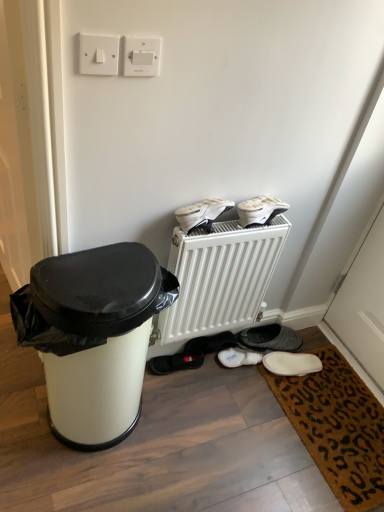
Identify the location of free space above brown coir mat at lower right (from a real-world perspective). This screenshot has height=512, width=384. (340, 411).